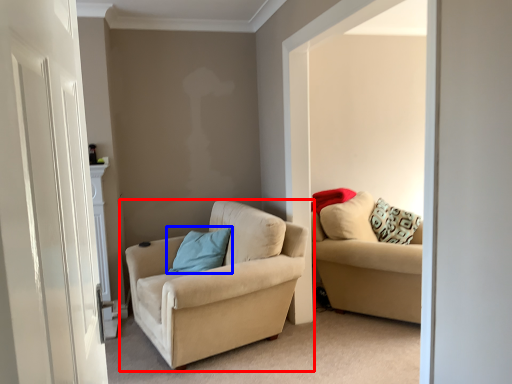
Question: Which object is further to the camera taking this photo, studio couch (highlighted by a red box) or pillow (highlighted by a blue box)?

Choices:
 (A) studio couch
 (B) pillow

Answer: (B)